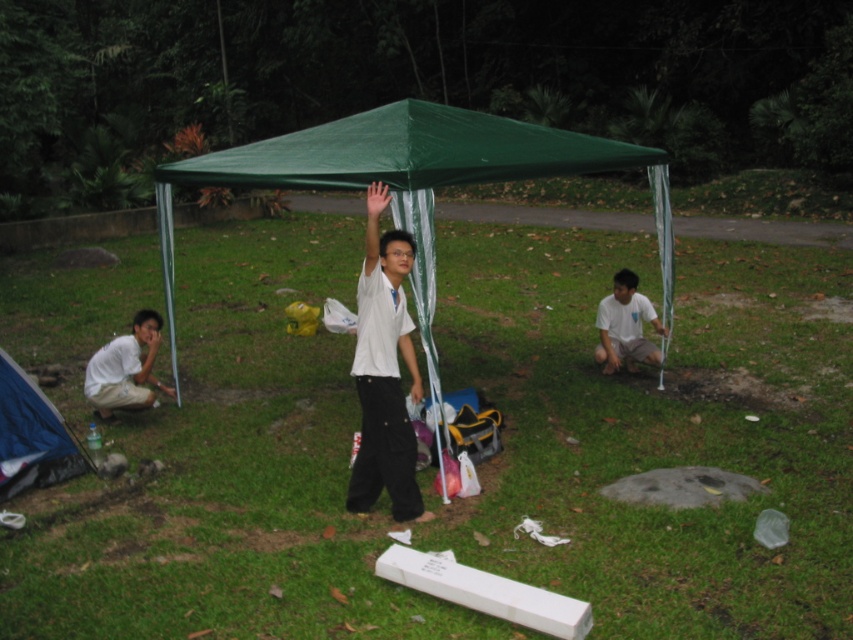
Who is shorter, green fabric tent at center or white matte shirt at center?

green fabric tent at center

Which is more to the left, green fabric tent at center or white matte shirt at center?

Positioned to the left is white matte shirt at center.

Describe the element at coordinates (393, 157) in the screenshot. I see `green fabric tent at center` at that location.

You are a GUI agent. You are given a task and a screenshot of the screen. Output one action in this format:
    pyautogui.click(x=<x>, y=<y>)
    Task: Click on the green fabric tent at center
    
    Given the screenshot: What is the action you would take?
    [x=393, y=157]

Does green grass at center appear over white cotton shirt at lower right?

Incorrect, green grass at center is not positioned above white cotton shirt at lower right.

Is green grass at center taller than white cotton shirt at lower right?

Yes, green grass at center is taller than white cotton shirt at lower right.

At what (x,y) coordinates should I click in order to perform the action: click on green grass at center. Please return your answer as a coordinate pair (x, y). Looking at the image, I should click on (654, 432).

Does blue fabric tent at lower left appear on the right side of white cotton shirt at lower right?

Incorrect, blue fabric tent at lower left is not on the right side of white cotton shirt at lower right.

Who is lower down, blue fabric tent at lower left or white cotton shirt at lower right?

Positioned lower is blue fabric tent at lower left.

Find the location of a particular element. Image resolution: width=853 pixels, height=640 pixels. blue fabric tent at lower left is located at coordinates (32, 435).